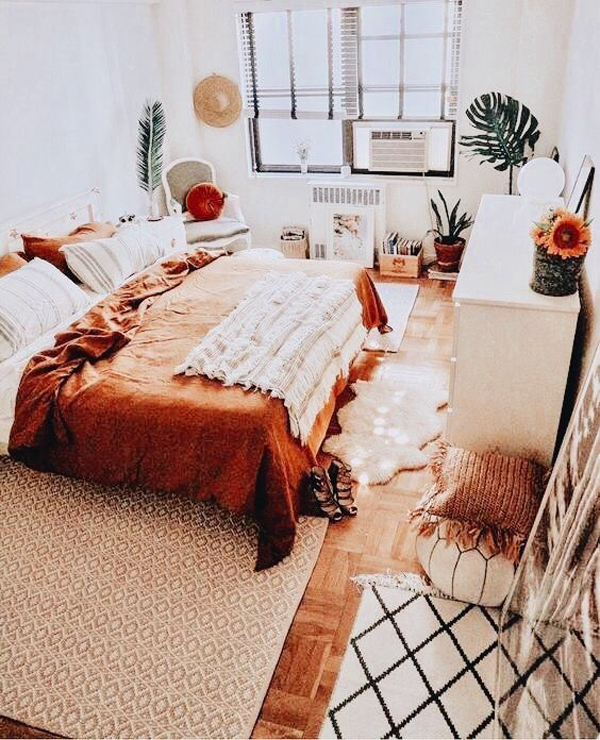
Locate an element on the screen. ottoman is located at coordinates (473, 575).